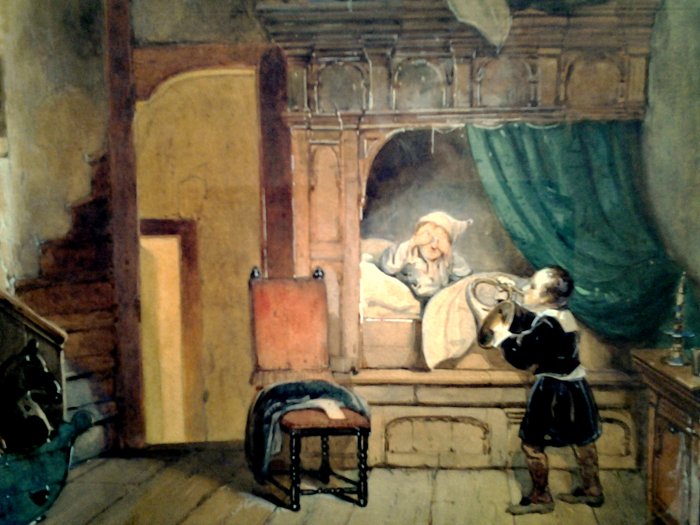
The height and width of the screenshot is (525, 700). In order to click on pillow in this screenshot , I will do `click(376, 282)`.